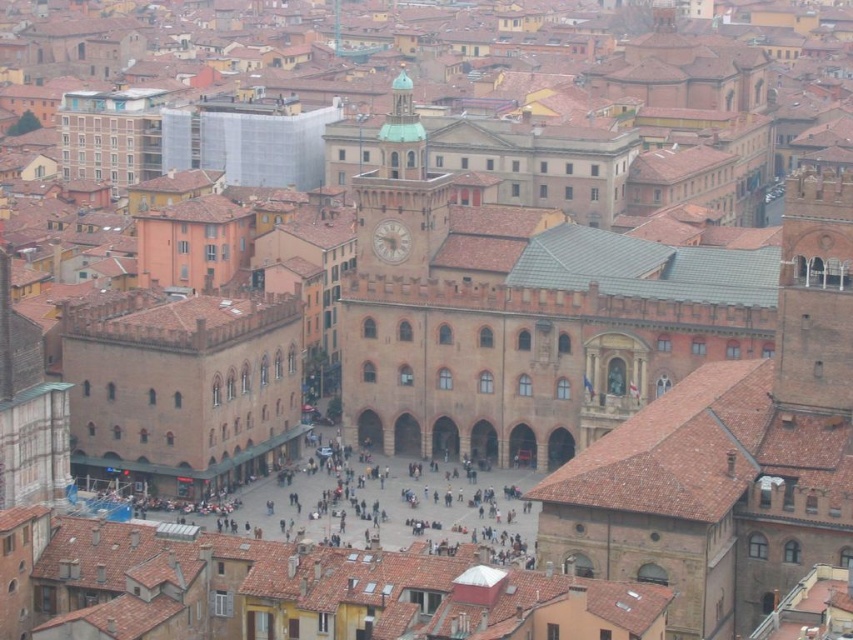
Question: Which point is closer to the camera?

Choices:
 (A) (399, 228)
 (B) (431, 477)
 (C) (363, 189)

Answer: (B)

Question: Among these objects, which one is nearest to the camera?

Choices:
 (A) green-tiled clock tower at center
 (B) dark gray stone plaza at center
 (C) white marble clock at center

Answer: (B)

Question: Does green-tiled clock tower at center appear on the left side of white marble clock at center?

Choices:
 (A) yes
 (B) no

Answer: (B)

Question: Can you confirm if green-tiled clock tower at center is positioned below white marble clock at center?

Choices:
 (A) yes
 (B) no

Answer: (B)

Question: Can you confirm if green-tiled clock tower at center is positioned to the left of white marble clock at center?

Choices:
 (A) no
 (B) yes

Answer: (A)

Question: Among these points, which one is nearest to the camera?

Choices:
 (A) (401, 253)
 (B) (389, 131)

Answer: (A)